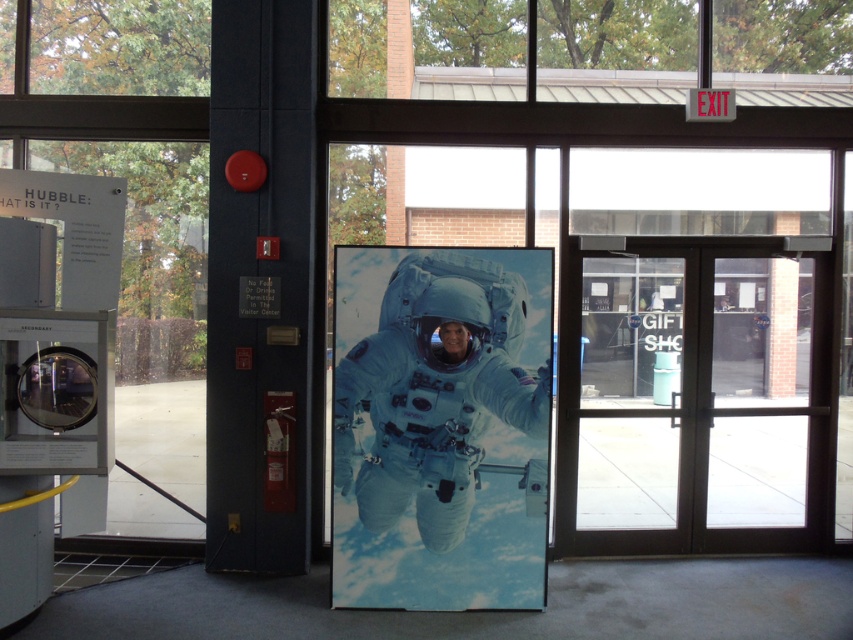
Which is more to the left, brown glass doors at center or white glossy astronaut suit at center?

Positioned to the left is white glossy astronaut suit at center.

Is brown glass doors at center taller than white glossy astronaut suit at center?

Indeed, brown glass doors at center has a greater height compared to white glossy astronaut suit at center.

This screenshot has height=640, width=853. What do you see at coordinates (704, 403) in the screenshot?
I see `brown glass doors at center` at bounding box center [704, 403].

At what (x,y) coordinates should I click in order to perform the action: click on brown glass doors at center. Please return your answer as a coordinate pair (x, y). Looking at the image, I should click on (704, 403).

Who is taller, brown glass doors at center or transparent glass door at center?

transparent glass door at center is taller.

Is brown glass doors at center to the left of transparent glass door at center from the viewer's perspective?

Yes, brown glass doors at center is to the left of transparent glass door at center.

Where is `brown glass doors at center`? brown glass doors at center is located at coordinates (704, 403).

Identify the location of brown glass doors at center. pos(704,403).

Does white glossy astronaut suit at center appear on the right side of transparent glass door at center?

No, white glossy astronaut suit at center is not to the right of transparent glass door at center.

Which of these two, white glossy astronaut suit at center or transparent glass door at center, stands shorter?

white glossy astronaut suit at center

Image resolution: width=853 pixels, height=640 pixels. In order to click on white glossy astronaut suit at center in this screenshot , I will do `click(440, 428)`.